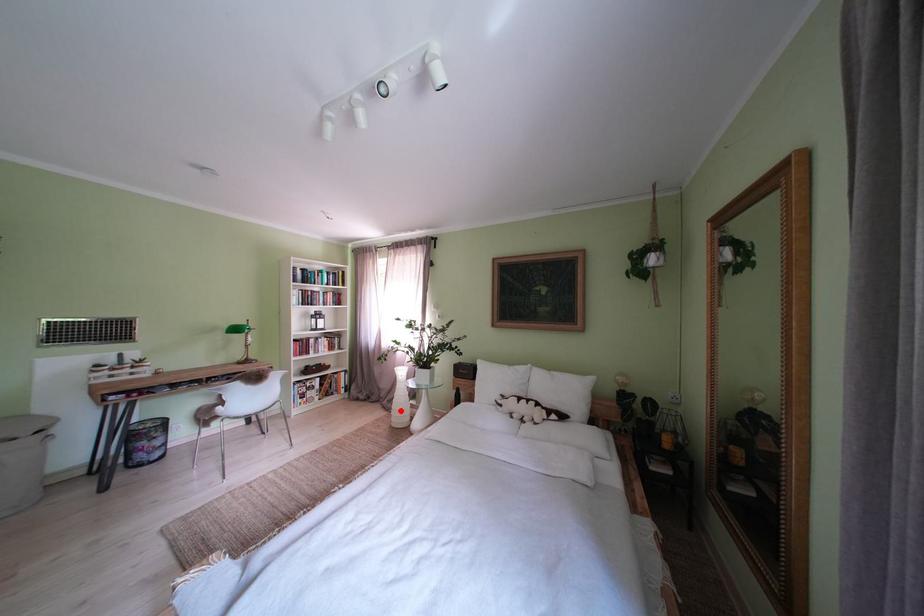
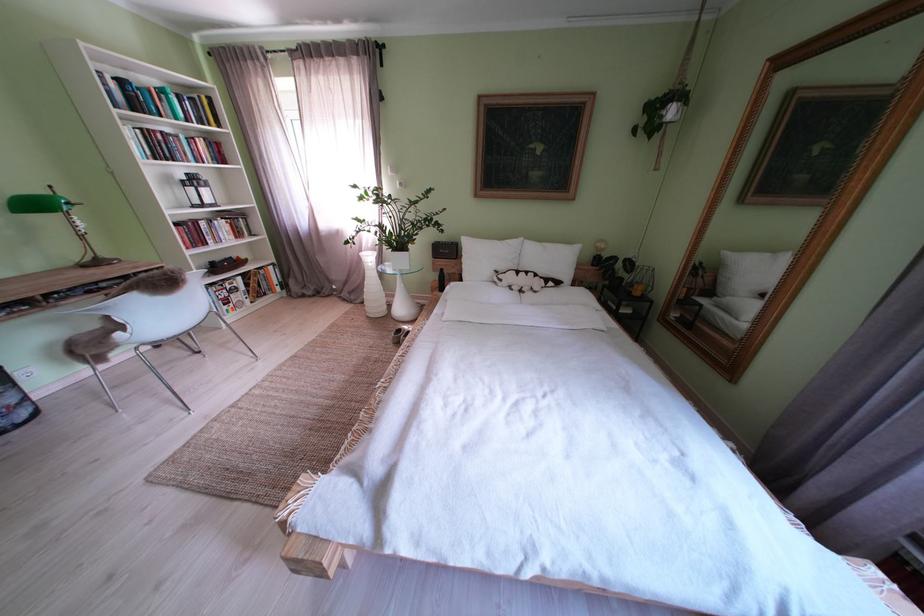
Find the pixel in the second image that matches the highlighted location in the first image.

(363, 302)